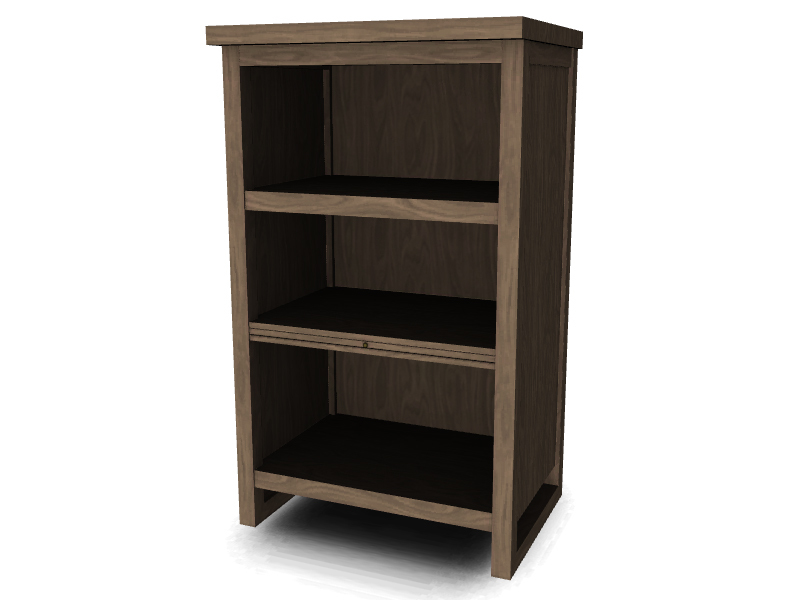
Identify the location of black shelf. This screenshot has height=600, width=800. (434, 475), (408, 316), (418, 190).